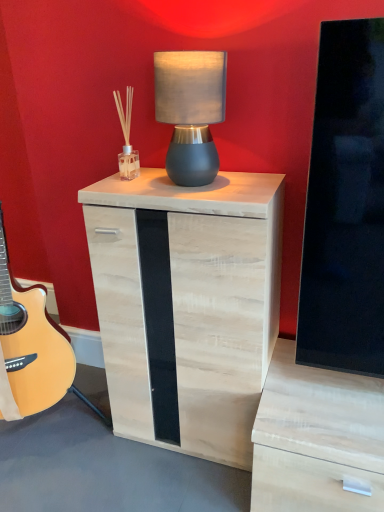
The image size is (384, 512). I want to click on free space above natural wood nightstand at center (from a real-world perspective), so click(206, 182).